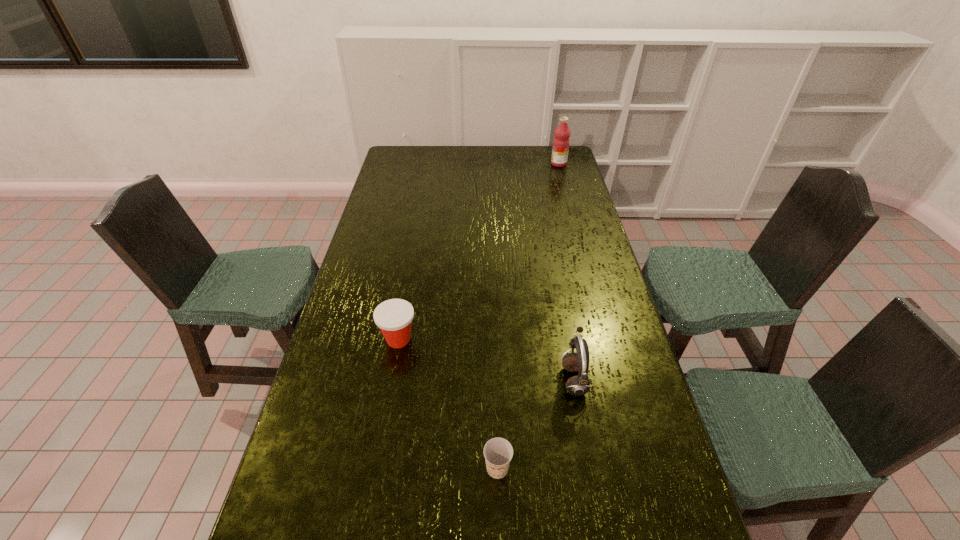
Identify the location of the farthest object. pos(561,142).

The width and height of the screenshot is (960, 540). I want to click on the rightmost object, so click(x=561, y=142).

In order to click on the third object from left to right in this screenshot , I will do `click(579, 385)`.

At what (x,y) coordinates should I click in order to perform the action: click on the third shortest object. Please return your answer as a coordinate pair (x, y). This screenshot has height=540, width=960. Looking at the image, I should click on (579, 385).

Locate an element on the screen. The width and height of the screenshot is (960, 540). the third tallest object is located at coordinates (394, 317).

You are a GUI agent. You are given a task and a screenshot of the screen. Output one action in this format:
    pyautogui.click(x=<x>, y=<y>)
    Task: Click on the leftmost object
    The width and height of the screenshot is (960, 540).
    Given the screenshot: What is the action you would take?
    pyautogui.click(x=394, y=317)

This screenshot has width=960, height=540. I want to click on the shortest object, so click(x=498, y=452).

Identify the location of the nearest object. (498, 452).

The height and width of the screenshot is (540, 960). Find the location of `vacant space located on the label of the tallest object`. vacant space located on the label of the tallest object is located at coordinates (533, 164).

Locate an element on the screen. vacant area situated 0.160m on the label of the tallest object is located at coordinates (518, 164).